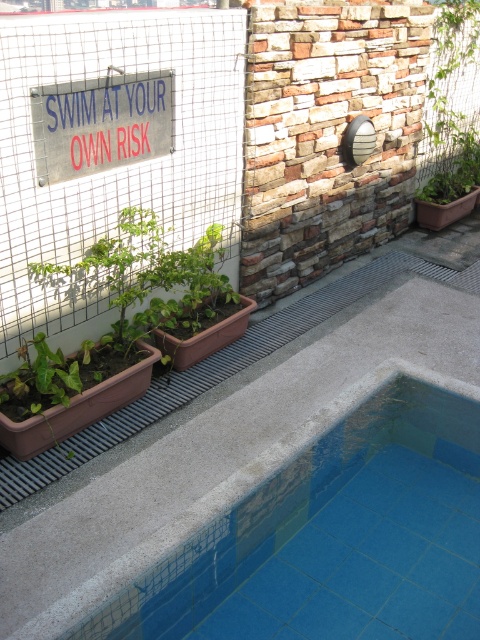
You are standing on the rooftop and want to place a new bench between the blue tile swimming pool at lower center and the green leafy plant at upper right. Based on their positions, which object should the bench be closer to?

The bench should be placed closer to the green leafy plant at upper right because the blue tile swimming pool at lower center is positioned on the left side of it.

You are designing a layout for a rooftop pool and need to place two elements based on their sizes. You have a metallic sign at upper left and a green leafy plant at upper right. Which object requires more horizontal space for placement?

The green leafy plant at upper right requires more horizontal space because its width is greater than the metallic sign at upper left.